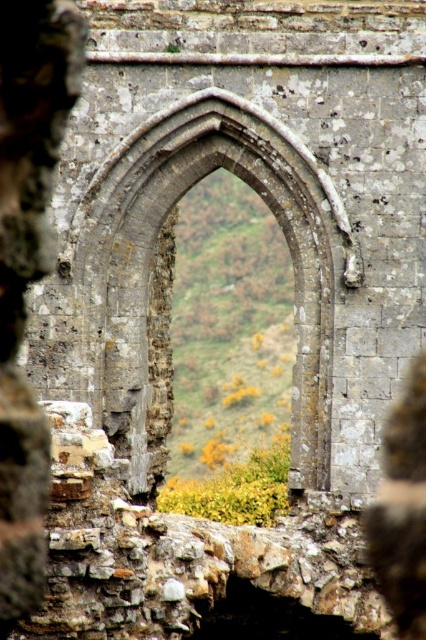
You are standing in front of an ancient stone archway. The archway is part of a historical ruin with weathered gray stones. There is a specific point marked at coordinates point (152,244). Can you tell me where this point is located in relation to the stone archway at center?

The stone archway at center is located at point (152,244).

You are an archaeologist examining the ancient stone structure. You notice the stone archway at center and the smooth stone wall at center. Which of these two objects is closer to you?

The stone archway at center is closer to you than the smooth stone wall at center.